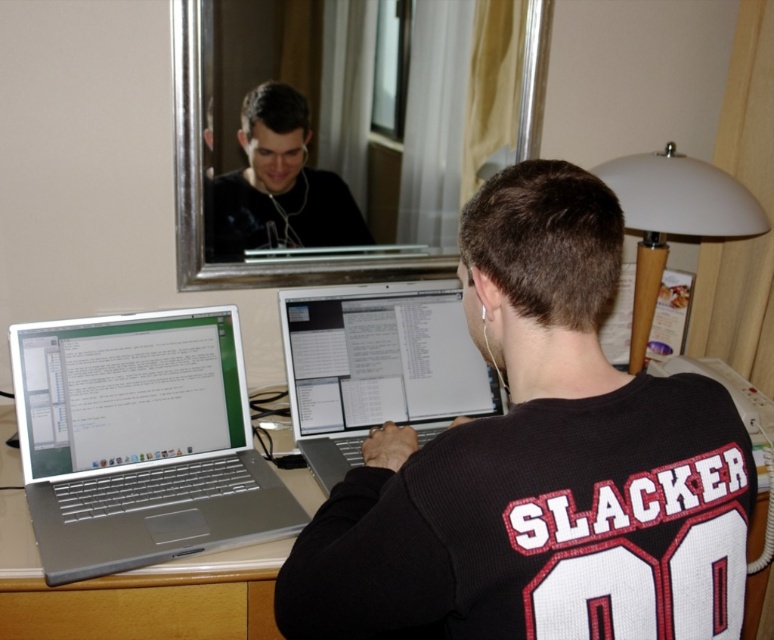
Question: Which point is farther from the camera taking this photo?

Choices:
 (A) (218, 612)
 (B) (341, 353)
 (C) (166, 605)
 (D) (663, 499)

Answer: (B)

Question: Is black jersey at center to the left of white plastic lampshade at upper right from the viewer's perspective?

Choices:
 (A) no
 (B) yes

Answer: (B)

Question: Is silver metallic laptop at left to the left of matte black shirt at upper center from the viewer's perspective?

Choices:
 (A) no
 (B) yes

Answer: (B)

Question: Which is farther from the silver metallic laptop at left?

Choices:
 (A) black jersey at center
 (B) silver metallic laptop at center
 (C) matte black shirt at upper center

Answer: (A)

Question: Which of the following is the closest to the observer?

Choices:
 (A) silver metallic laptop at left
 (B) silver/metallic mirror at upper center

Answer: (A)

Question: Does silver metallic laptop at center appear under silver metallic table at center?

Choices:
 (A) no
 (B) yes

Answer: (A)